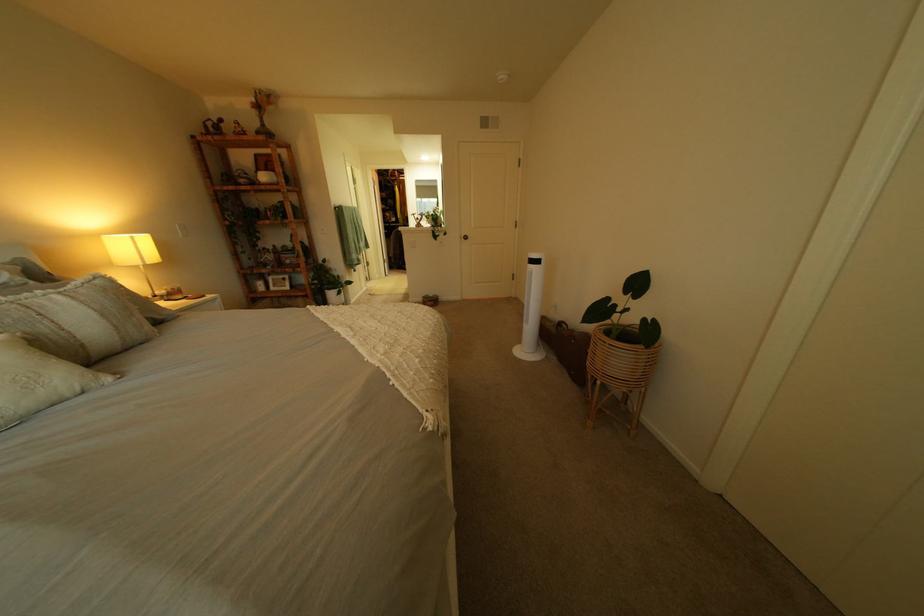
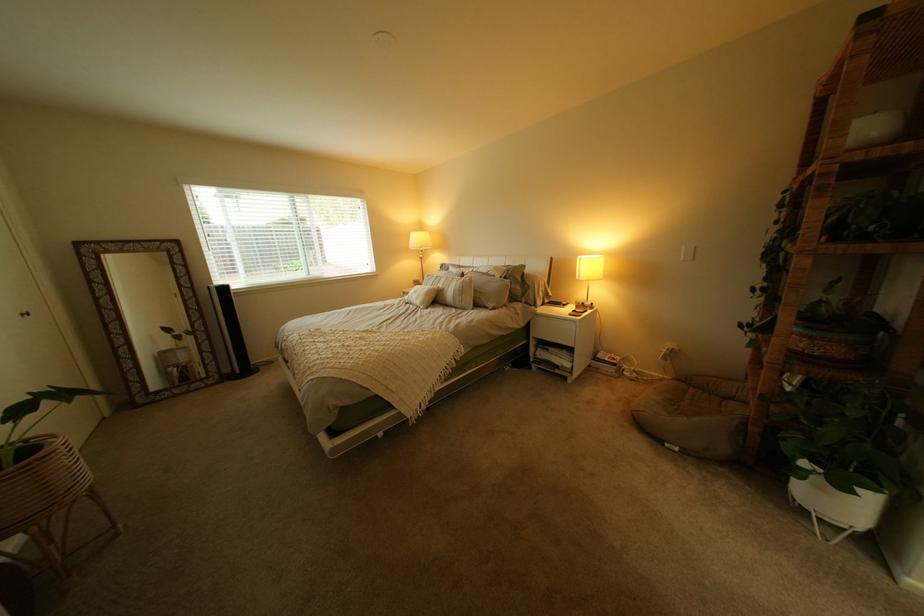
Where in the second image is the point corresponding to the point at 193,317 from the first image?

(509, 310)